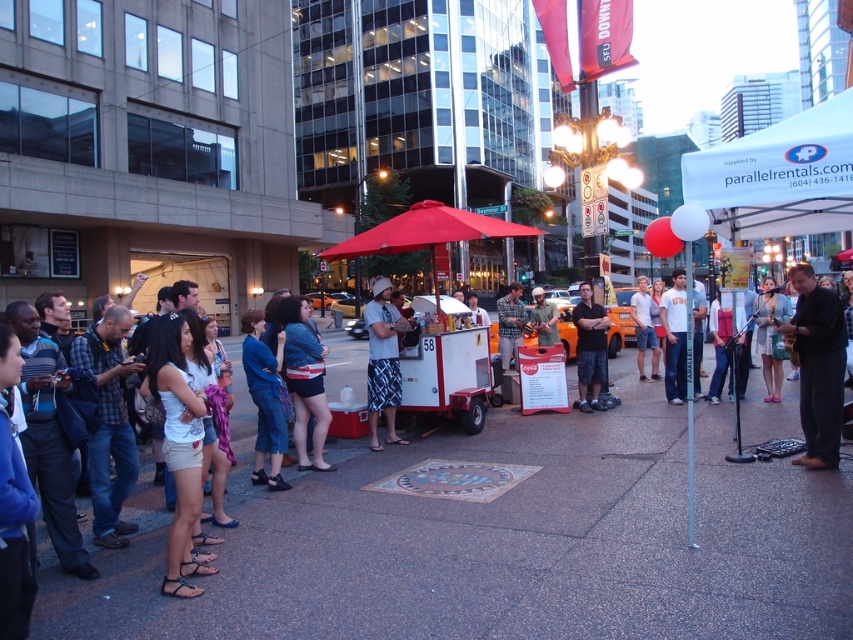
You are a customer in the city and want to buy a drink from the food cart. You notice two people waiting in line. One is wearing a black smooth suit at right and the other is wearing dark blue shorts at center. Which person should you stand behind to get served faster?

The black smooth suit at right is bigger than the dark blue shorts at center, so the person in the dark blue shorts at center is smaller and might be served faster. You should stand behind the dark blue shorts at center.